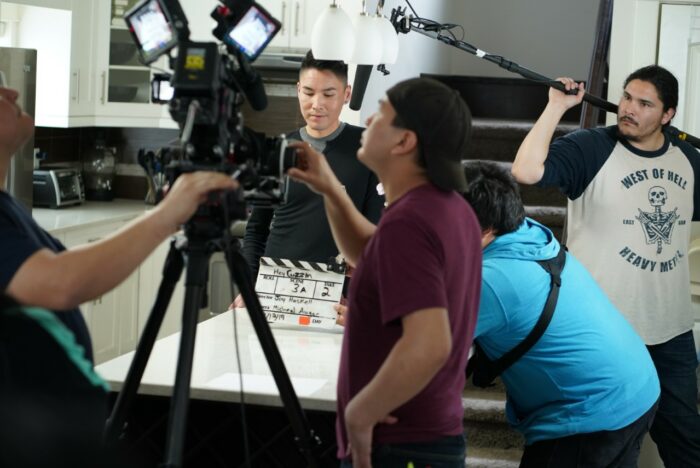
At what (x,y) coordinates should I click in order to perform the action: click on black cord on left side hanging from camera on tripod. Please return your answer as a coordinate pair (x, y). This screenshot has width=700, height=468. Looking at the image, I should click on (x=237, y=309), (x=238, y=341).